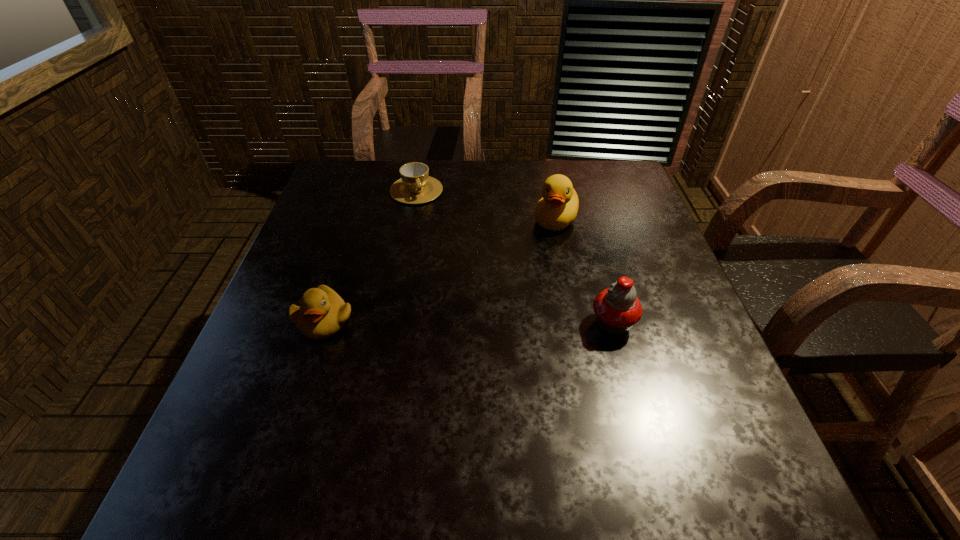
Locate an element on the screen. empty space that is in between the cupcake and the third tallest object is located at coordinates (468, 322).

Identify the location of vacant area that lies between the third object from right to left and the duck. The height and width of the screenshot is (540, 960). (487, 205).

In order to click on vacant area that lies between the cupcake and the third tallest object in this screenshot , I will do `click(468, 322)`.

This screenshot has width=960, height=540. What are the coordinates of `empty space between the shortest object and the cupcake` in the screenshot? It's located at (515, 257).

Where is `free space between the duck and the cup`? The width and height of the screenshot is (960, 540). free space between the duck and the cup is located at coordinates (487, 205).

Locate which object ranks third in proximity to the duck. Please provide its 2D coordinates. Your answer should be formatted as a tuple, i.e. [(x, y)], where the tuple contains the x and y coordinates of a point satisfying the conditions above.

[(322, 313)]

You are a GUI agent. You are given a task and a screenshot of the screen. Output one action in this format:
    pyautogui.click(x=<x>, y=<y>)
    Task: Click on the object that ranks as the third closest to the cupcake
    
    Given the screenshot: What is the action you would take?
    pyautogui.click(x=416, y=186)

Identify the location of free spot that satisfies the following two spatial constraints: 1. on the front side of the cup; 2. on the left side of the duck. Image resolution: width=960 pixels, height=540 pixels. (411, 220).

The width and height of the screenshot is (960, 540). I want to click on blank area in the image that satisfies the following two spatial constraints: 1. at the beak of the cupcake; 2. on the left side of the leftmost object, so click(x=324, y=323).

What are the coordinates of `vacant region that satisfies the following two spatial constraints: 1. at the beak of the cupcake; 2. on the right side of the leftmost object` in the screenshot? It's located at (324, 323).